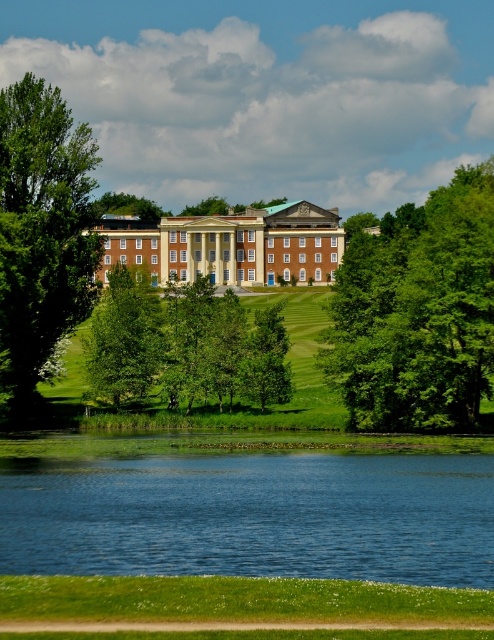
Question: Can you confirm if green leafy tree at center-right is positioned to the left of green leafy tree at left?

Choices:
 (A) yes
 (B) no

Answer: (B)

Question: Does green leafy tree at center appear under green leafy tree at lower left?

Choices:
 (A) yes
 (B) no

Answer: (A)

Question: Which object is closer to the camera taking this photo?

Choices:
 (A) brick building at center
 (B) green leafy tree at lower left
 (C) blue liquid water at lower center

Answer: (C)

Question: Does green leafy tree at center-right appear over green leafy tree at left?

Choices:
 (A) yes
 (B) no

Answer: (A)

Question: Estimate the real-world distances between objects in this image. Which object is farther from the blue liquid water at lower center?

Choices:
 (A) brick building at center
 (B) green leafy tree at center-right

Answer: (A)

Question: Which point appears farthest from the camera in this image?

Choices:
 (A) (150, 355)
 (B) (158, 554)
 (C) (405, 392)

Answer: (A)